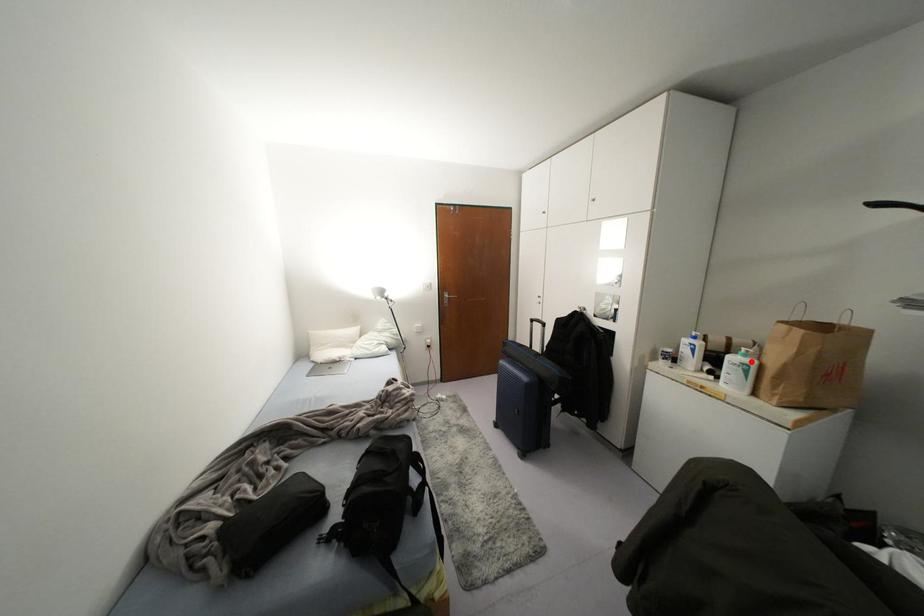
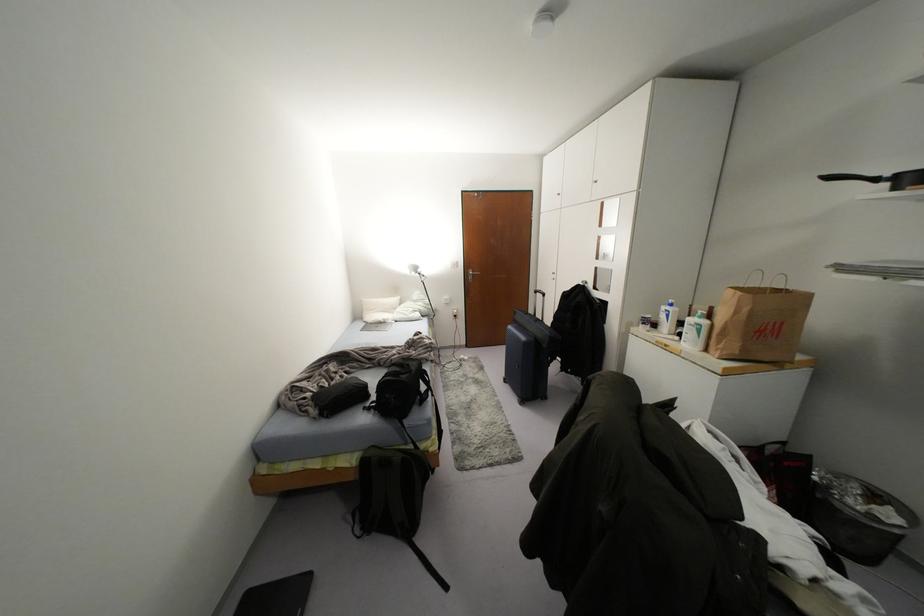
The point at the highlighted location is marked in the first image. Where is the corresponding point in the second image?

(703, 322)